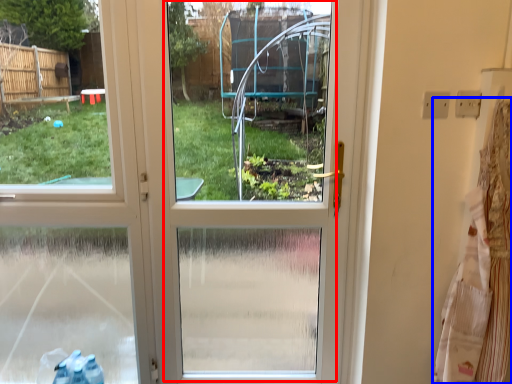
Question: Which object is further to the camera taking this photo, screen door (highlighted by a red box) or laundry (highlighted by a blue box)?

Choices:
 (A) screen door
 (B) laundry

Answer: (A)